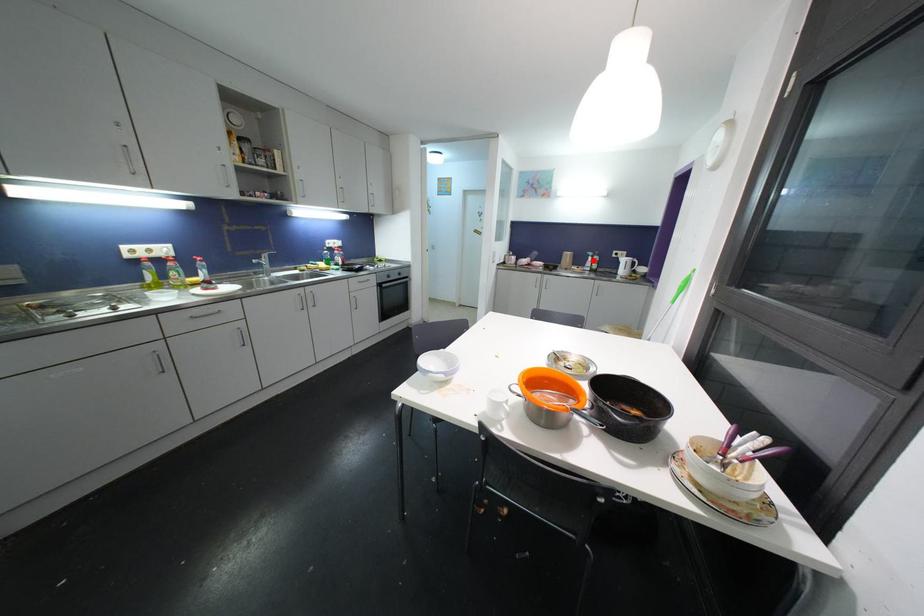
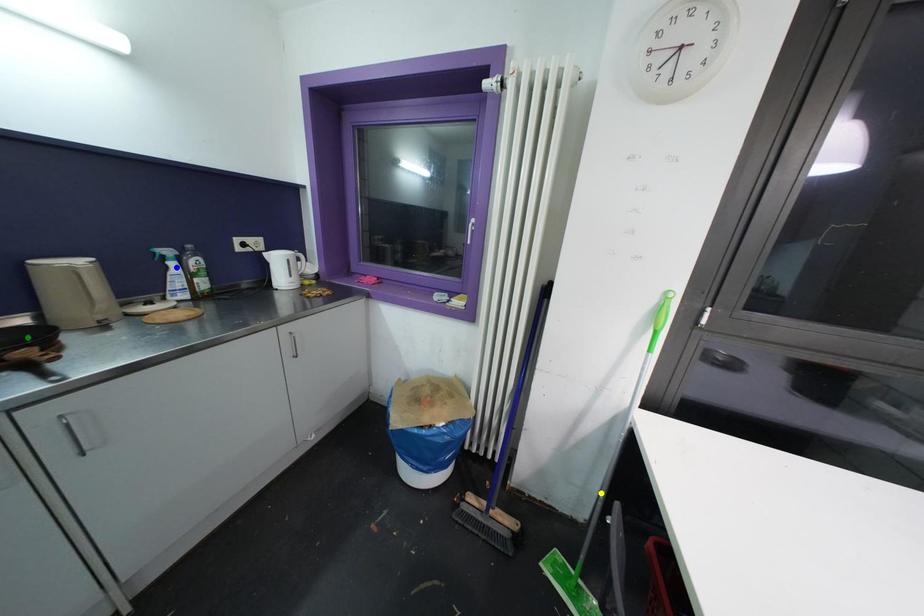
Question: I am providing you with two images of the same scene from different viewpoints. A red point is marked on the first image. You are given multiple points on the second image. In image 2, which mark is for the same physical point as the one in image 1?

Choices:
 (A) blue point
 (B) green point
 (C) yellow point

Answer: (A)